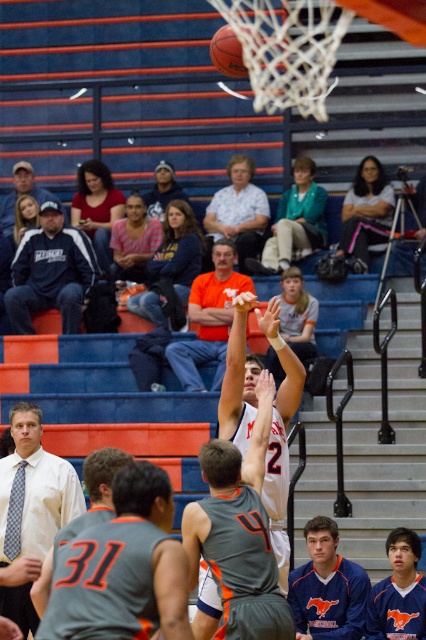
Who is more distant from viewer, (322,602) or (305,204)?

The point (305,204) is more distant.

Is blue fleece jacket at center smaller than green fabric jacket at center?

Yes, blue fleece jacket at center is smaller than green fabric jacket at center.

Locate an element on the screen. Image resolution: width=426 pixels, height=640 pixels. blue fleece jacket at center is located at coordinates (328, 588).

The width and height of the screenshot is (426, 640). In order to click on blue fleece jacket at center in this screenshot , I will do `click(328, 588)`.

Describe the element at coordinates (239, 524) in the screenshot. I see `white matte basketball player at center` at that location.

The width and height of the screenshot is (426, 640). In order to click on white matte basketball player at center in this screenshot , I will do `click(239, 524)`.

Is blue fleece jacket at center wider than dark blue baseball cap at upper left?

No.

Who is shorter, blue fleece jacket at center or dark blue baseball cap at upper left?

Standing shorter between the two is dark blue baseball cap at upper left.

Is point (319, 604) less distant than point (8, 196)?

Yes, point (319, 604) is in front of point (8, 196).

I want to click on blue fleece jacket at center, so click(x=328, y=588).